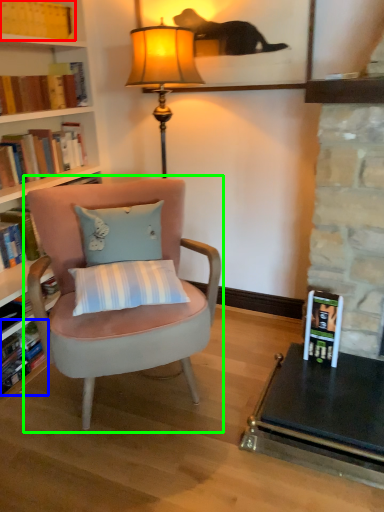
Question: Which object is positioned farthest from book (highlighted by a red box)? Select from book (highlighted by a blue box) and chair (highlighted by a green box).

Choices:
 (A) book
 (B) chair

Answer: (A)